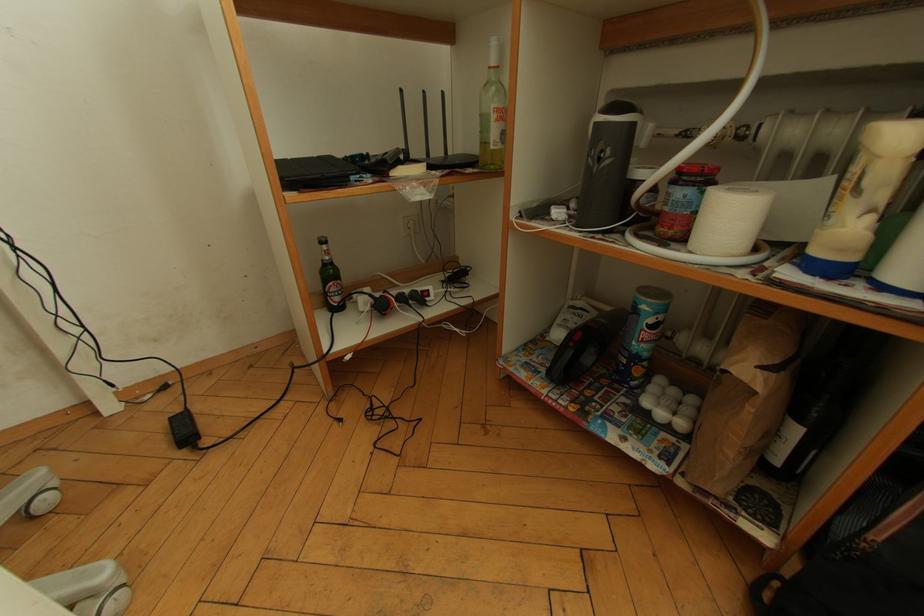
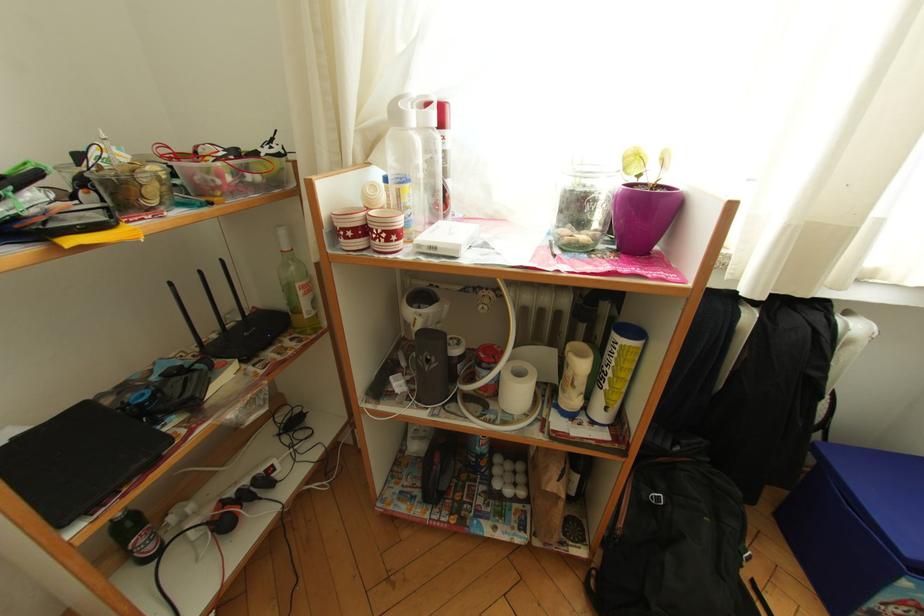
Question: Based on the continuous images, in which direction is the camera rotating? Reply with the corresponding letter.

Choices:
 (A) Left
 (B) Right
 (C) Up
 (D) Down

Answer: (B)